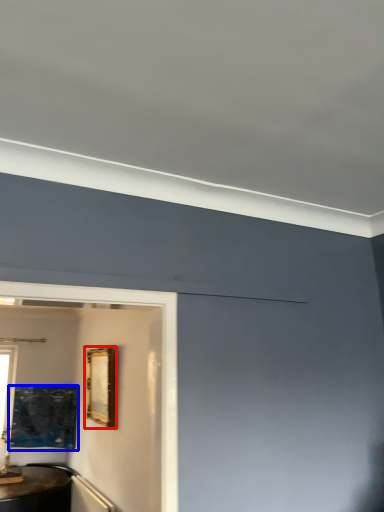
Question: Which object appears closest to the camera in this image, picture frame (highlighted by a red box) or picture frame (highlighted by a blue box)?

Choices:
 (A) picture frame
 (B) picture frame

Answer: (A)